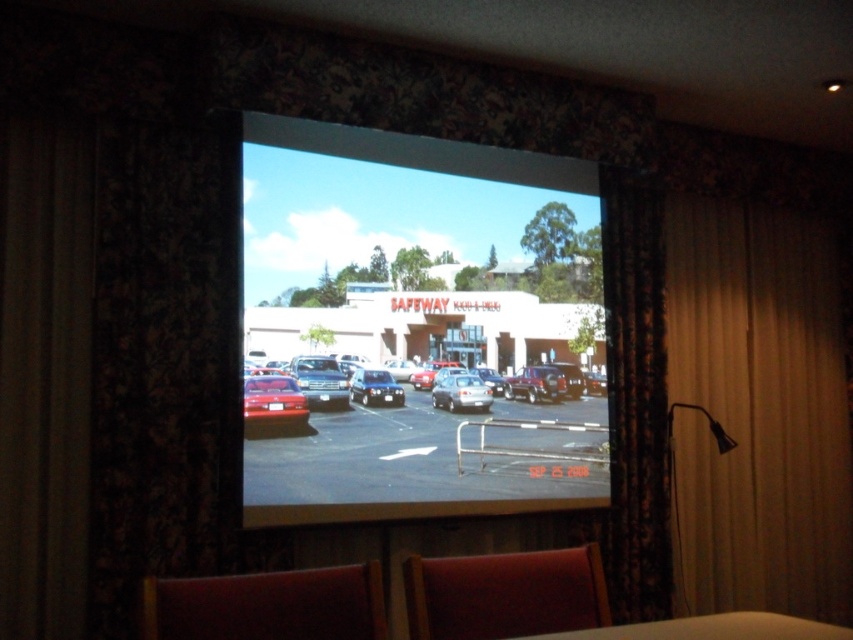
I want to click on metallic silver cars at center, so click(x=416, y=448).

You are a GUI agent. You are given a task and a screenshot of the screen. Output one action in this format:
    pyautogui.click(x=<x>, y=<y>)
    Task: Click on the metallic silver cars at center
    This screenshot has width=853, height=640.
    Given the screenshot: What is the action you would take?
    pyautogui.click(x=416, y=448)

Is point (485, 582) positioned after point (556, 388)?

No, it is not.

Based on the photo, does velvet red chair at center have a lesser height compared to shiny silver sedan at center?

In fact, velvet red chair at center may be taller than shiny silver sedan at center.

Identify the location of velvet red chair at center. This screenshot has height=640, width=853. [505, 593].

Is point (801, 300) less distant than point (296, 392)?

No, (801, 300) is further to viewer.

Consider the image. Is beige fabric curtain at right bigger than matte red car at center?

Indeed, beige fabric curtain at right has a larger size compared to matte red car at center.

Locate an element on the screen. This screenshot has width=853, height=640. beige fabric curtain at right is located at coordinates [x=758, y=412].

This screenshot has height=640, width=853. I want to click on beige fabric curtain at right, so click(758, 412).